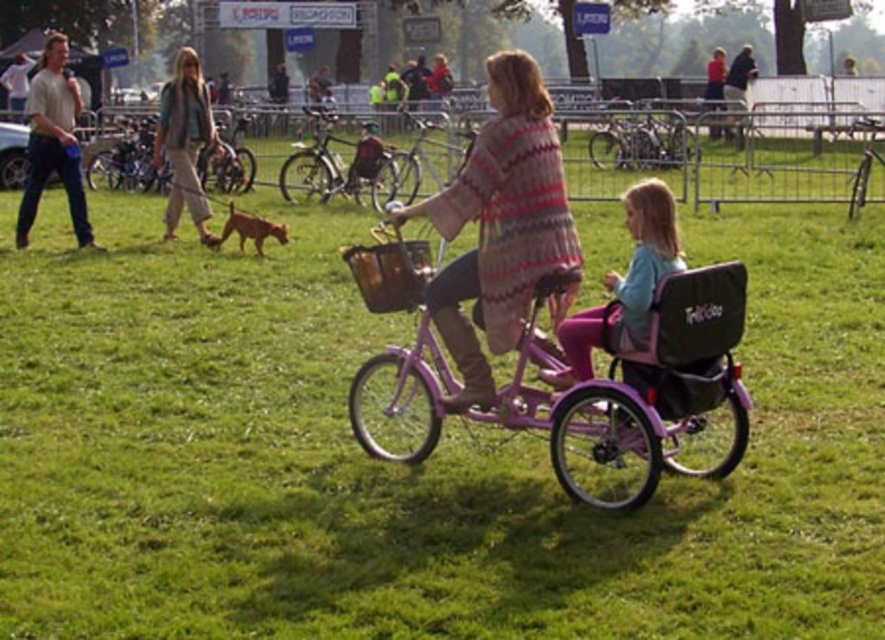
Measure the distance between point (653, 147) and camera.

Point (653, 147) is 21.33 meters from camera.

Does metallic silver bicycle at center have a larger size compared to silver metallic bicycle at right?

No.

What do you see at coordinates (637, 138) in the screenshot?
I see `metallic silver bicycle at center` at bounding box center [637, 138].

This screenshot has width=885, height=640. I want to click on metallic silver bicycle at center, so click(637, 138).

Can you confirm if matte black basket at center is positioned to the right of silver metallic bicycle at right?

No, matte black basket at center is not to the right of silver metallic bicycle at right.

Does point (402, 301) lie in front of point (853, 177)?

Yes, it is.

Measure the distance between matte black basket at center and camera.

6.67 meters

Where is `matte black basket at center`? Image resolution: width=885 pixels, height=640 pixels. matte black basket at center is located at coordinates (390, 273).

Does purple matte tricycle at center appear over silver metallic bicycle at right?

No, purple matte tricycle at center is not above silver metallic bicycle at right.

Does purple matte tricycle at center have a lesser height compared to silver metallic bicycle at right?

No, purple matte tricycle at center is not shorter than silver metallic bicycle at right.

Between point (681, 419) and point (862, 164), which one is positioned behind?

The point (862, 164) is behind.

At what (x,y) coordinates should I click in order to perform the action: click on purple matte tricycle at center. Please return your answer as a coordinate pair (x, y). Looking at the image, I should click on (641, 387).